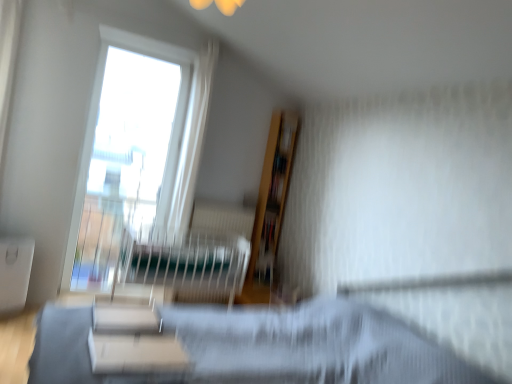
Question: From a real-world perspective, is matte black hospital bed at center above or below white glossy bookshelf at center?

Choices:
 (A) below
 (B) above

Answer: (B)

Question: From the image's perspective, is matte black hospital bed at center positioned above or below white glossy bookshelf at center?

Choices:
 (A) above
 (B) below

Answer: (A)

Question: Which is nearer to the transparent glass window at upper left?

Choices:
 (A) matte black hospital bed at center
 (B) white matte table at lower left, the 2th table positioned from the front
 (C) wooden bookshelf at upper center
 (D) white glossy bookshelf at center
 (E) white matte table at lower center, which is counted as the 2th table, starting from the left

Answer: (A)

Question: Considering the real-world distances, which object is closest to the white matte table at lower center, which is the 2th table in back-to-front order?

Choices:
 (A) white matte table at lower left, which is the first table in left-to-right order
 (B) white glossy bookshelf at center
 (C) wooden bookshelf at upper center
 (D) matte black hospital bed at center
 (E) transparent glass window at upper left

Answer: (B)